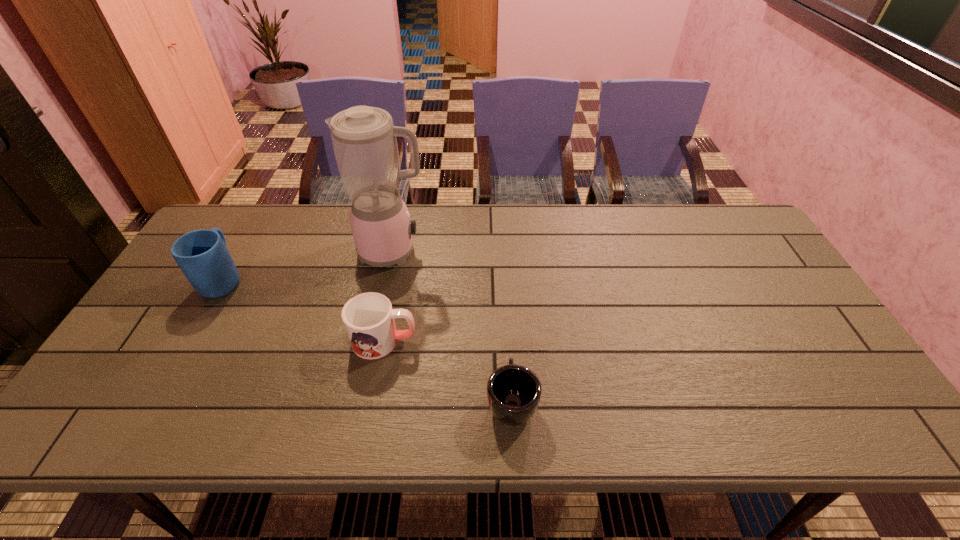
Identify the location of free spot that satisfies the following two spatial constraints: 1. on the base of the tallest object near the control knob; 2. on the side of the nearest mug with the handle. (362, 401).

The height and width of the screenshot is (540, 960). What are the coordinates of `vacant point that satisfies the following two spatial constraints: 1. on the side of the nearest mug with the handle; 2. on the base of the tallest object near the control knob` in the screenshot? It's located at (503, 252).

This screenshot has height=540, width=960. In order to click on vacant region that satisfies the following two spatial constraints: 1. on the side of the rightmost mug with the handle; 2. on the base of the food processor near the control knob in this screenshot , I will do `click(503, 252)`.